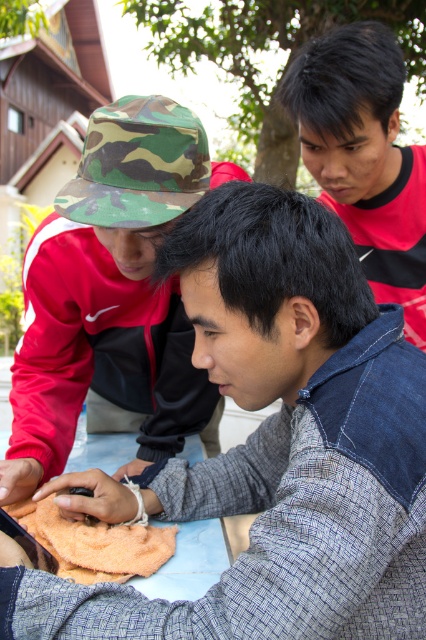
Question: Is the position of camo hat at upper left less distant than that of red shirt at upper right?

Choices:
 (A) no
 (B) yes

Answer: (B)

Question: Which point is closer to the camera?

Choices:
 (A) (31, 500)
 (B) (247, 240)
 (C) (357, 216)

Answer: (B)

Question: Can you confirm if red shirt at upper right is bigger than orange terry cloth at lower left?

Choices:
 (A) no
 (B) yes

Answer: (B)

Question: Among these objects, which one is nearest to the camera?

Choices:
 (A) orange terry cloth at lower left
 (B) red shirt at upper right
 (C) camouflage fabric hat at upper left
 (D) camo hat at upper left

Answer: (C)

Question: Among these points, which one is nearest to the camera?

Choices:
 (A) (97, 481)
 (B) (88, 173)

Answer: (A)

Question: Can you confirm if camo hat at upper left is positioned to the left of red shirt at upper right?

Choices:
 (A) no
 (B) yes

Answer: (B)